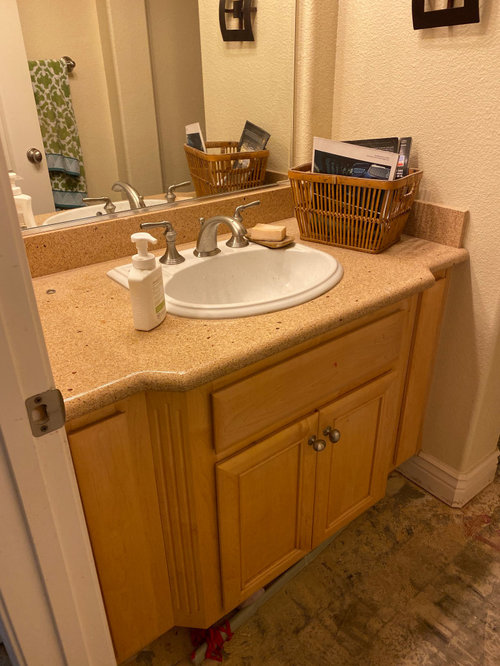
Locate an element on the screen. wall is located at coordinates (478, 182).